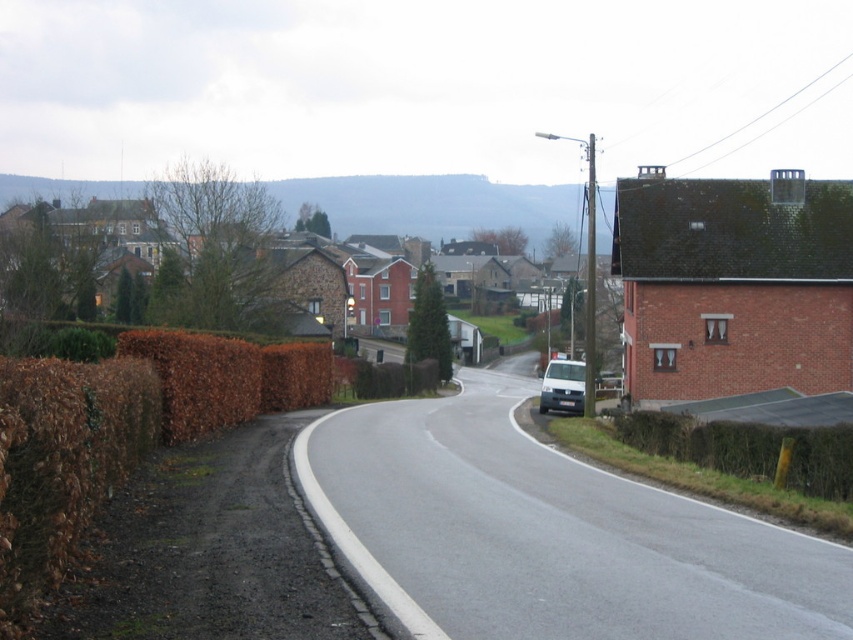
You are a pedestrian walking along the road and want to cross to the other side. There are two hedges, the brown dry hedge at left and the brown textured hedge at right. Which hedge should you go around to reach the opposite side of the road?

You should go around the brown textured hedge at right because the brown dry hedge at left is in front of it, meaning the brown textured hedge at right is further back and likely on the opposite side of the road.

You are driving a car and see the brown textured hedge at right and the white matte van at center. Which object is positioned to the left of the other?

The brown textured hedge at right is to the left of the white matte van at center.

You are a delivery driver approaching the red brick building on the right side of the road. You need to make a left turn onto the road ahead. There is a point marked at coordinates (120, 433). Is this point located on the brown dry hedge on the left side of the road?

Yes, the point (120, 433) is located on the brown dry hedge at left, so it is on the left side of the road.